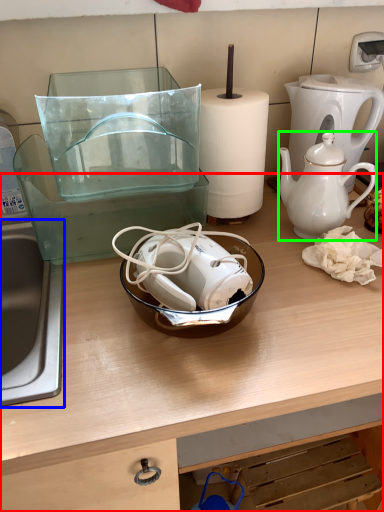
Question: Estimate the real-world distances between objects in this image. Which object is closer to table (highlighted by a red box), sink (highlighted by a blue box) or teapot (highlighted by a green box)?

Choices:
 (A) sink
 (B) teapot

Answer: (A)